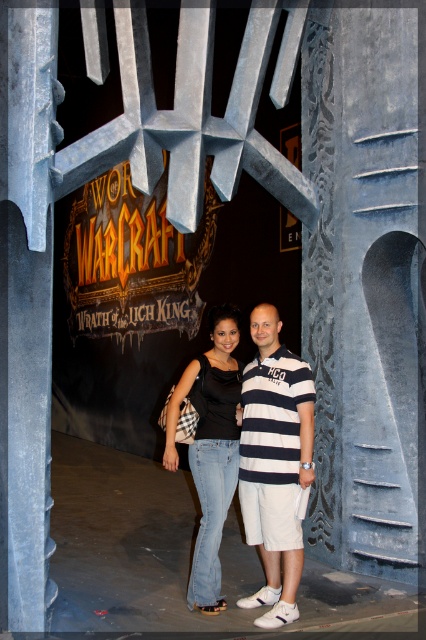
Does white striped polo shirt at center come behind denim jeans at center?

No.

Does point (247, 529) come in front of point (236, 340)?

Yes, it is in front of point (236, 340).

Find the location of `white striped polo shirt at center`. white striped polo shirt at center is located at coordinates (275, 461).